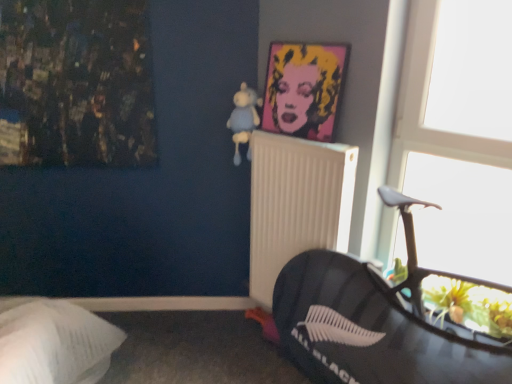
Question: Does white plastic radiator at center have a lesser width compared to pop art portrait at upper center?

Choices:
 (A) yes
 (B) no

Answer: (B)

Question: Is white plastic radiator at center placed right next to pop art portrait at upper center?

Choices:
 (A) yes
 (B) no

Answer: (B)

Question: Considering the relative sizes of white plastic radiator at center and pop art portrait at upper center in the image provided, is white plastic radiator at center wider than pop art portrait at upper center?

Choices:
 (A) yes
 (B) no

Answer: (A)

Question: From a real-world perspective, is white plastic radiator at center physically below pop art portrait at upper center?

Choices:
 (A) yes
 (B) no

Answer: (A)

Question: From a real-world perspective, is white plastic radiator at center on pop art portrait at upper center?

Choices:
 (A) yes
 (B) no

Answer: (B)

Question: Is pop art portrait at upper center inside or outside of white plastic radiator at center?

Choices:
 (A) inside
 (B) outside

Answer: (B)

Question: Is pop art portrait at upper center bigger or smaller than white plastic radiator at center?

Choices:
 (A) big
 (B) small

Answer: (B)

Question: From the image's perspective, is pop art portrait at upper center positioned above or below white plastic radiator at center?

Choices:
 (A) below
 (B) above

Answer: (B)

Question: Does point (282, 74) appear closer or farther from the camera than point (327, 213)?

Choices:
 (A) closer
 (B) farther

Answer: (B)

Question: Considering the positions of white plastic radiator at center and pop art portrait at upper center in the image, is white plastic radiator at center taller or shorter than pop art portrait at upper center?

Choices:
 (A) tall
 (B) short

Answer: (A)

Question: Do you think white plastic radiator at center is within pop art portrait at upper center, or outside of it?

Choices:
 (A) inside
 (B) outside

Answer: (B)

Question: From a real-world perspective, relative to pop art portrait at upper center, is white plastic radiator at center vertically above or below?

Choices:
 (A) below
 (B) above

Answer: (A)

Question: Considering the positions of white plastic radiator at center and pop art portrait at upper center in the image, is white plastic radiator at center wider or thinner than pop art portrait at upper center?

Choices:
 (A) thin
 (B) wide

Answer: (B)

Question: In terms of size, does light blue plush at upper center appear bigger or smaller than white plastic radiator at center?

Choices:
 (A) small
 (B) big

Answer: (A)

Question: Considering the positions of light blue plush at upper center and white plastic radiator at center in the image, is light blue plush at upper center taller or shorter than white plastic radiator at center?

Choices:
 (A) short
 (B) tall

Answer: (A)